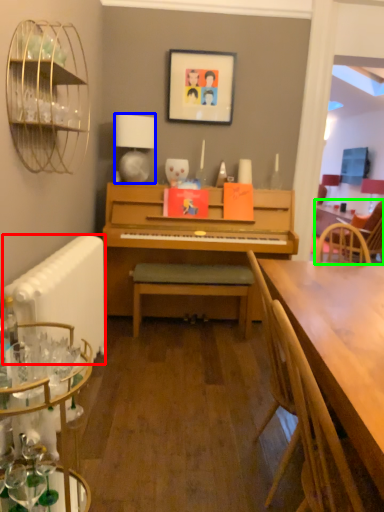
Question: Which object is the farthest from radiator (highlighted by a red box)? Choose among these: lamp (highlighted by a blue box) or chair (highlighted by a green box).

Choices:
 (A) lamp
 (B) chair

Answer: (B)